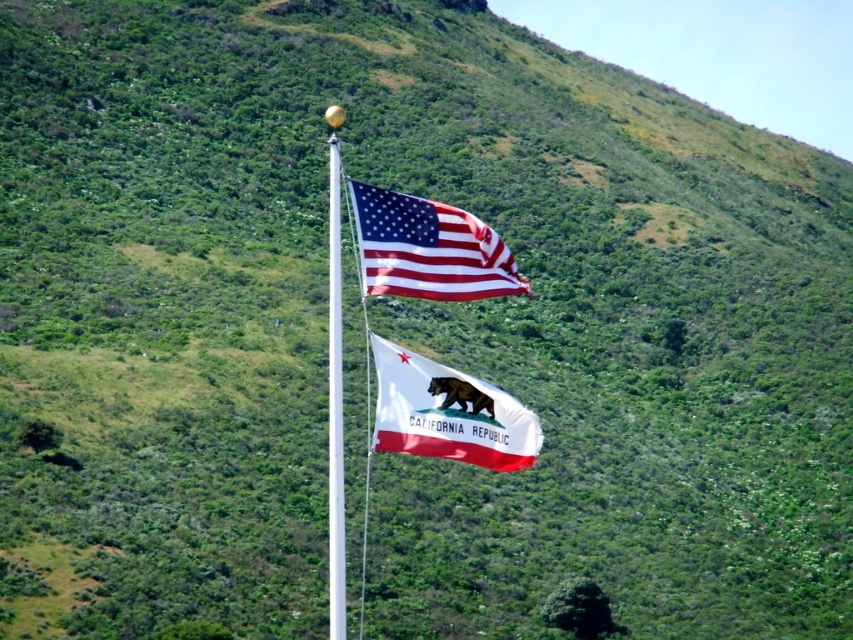
You are a photographer trying to capture both the matte fabric flag at upper center and the white glossy flag pole at center in a single frame. Based on their sizes, which object will appear smaller in the photo?

The matte fabric flag at upper center occupies less space than the white glossy flag pole at center, so it will appear smaller in the photo.

Based on the photo, you are a painter standing 20 meters away from the white fabric flag at center and the white glossy flag pole at center. You want to paint both objects in a single canvas. Given that your canvas can only capture objects within a 15 meter distance, will both objects be visible in your painting?

The white fabric flag at center and white glossy flag pole at center are 14.08 meters apart. Since the distance between them is less than 15 meters, both objects will be within the 15 meter range and thus visible in the painting.

You are a photographer trying to capture both the white fabric flag at center and the matte fabric flag at upper center in a single frame. Based on their sizes, which flag would appear smaller in the photo?

The white fabric flag at center appears smaller in the photo because its width is less than the matte fabric flag at upper center.